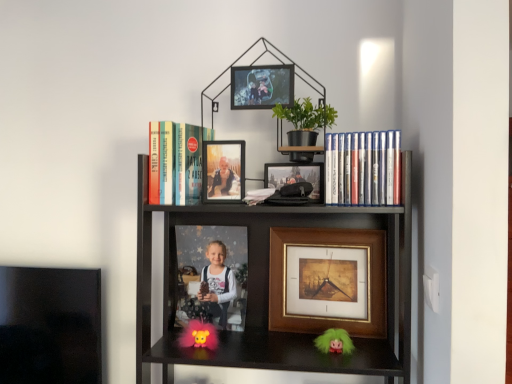
Question: Considering their positions, is green fuzzy doll at lower center located in front of or behind matte plastic photo frame at center, the third picture frame when ordered from top to bottom?

Choices:
 (A) behind
 (B) front

Answer: (B)

Question: From a real-world perspective, is green fuzzy doll at lower center above or below matte plastic photo frame at center, positioned as the 1th picture frame in back-to-front order?

Choices:
 (A) below
 (B) above

Answer: (A)

Question: Estimate the real-world distances between objects in this image. Which object is closer to the metallic silver picture frame at upper center, arranged as the 4th picture frame when viewed from the back?

Choices:
 (A) fluffy pink toy at center
 (B) gold/glossy picture frame at center, positioned as the 4th picture frame in top-to-bottom order
 (C) silver metallic dvds at right, arranged as the first book when viewed from the right
 (D) matte plastic photo frame at upper center, marked as the second picture frame in a top-to-bottom arrangement
 (E) hardcover book at upper left, acting as the 1th book starting from the left

Answer: (D)

Question: Which object is positioned closest to the gold/glossy picture frame at center, positioned as the 4th picture frame in top-to-bottom order?

Choices:
 (A) black matte bookcase at center
 (B) green fuzzy doll at lower center
 (C) hardcover book at upper left, which is counted as the 2th book, starting from the right
 (D) matte plastic photo frame at upper center, marked as the third picture frame in a bottom-to-top arrangement
 (E) silver metallic dvds at right, arranged as the first book when viewed from the right

Answer: (A)